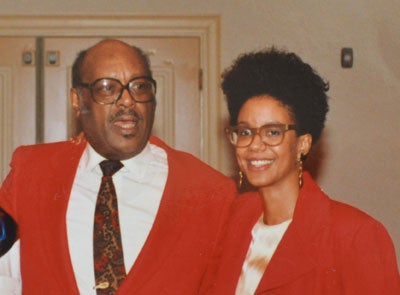
Identify the location of wall. (282, 35).